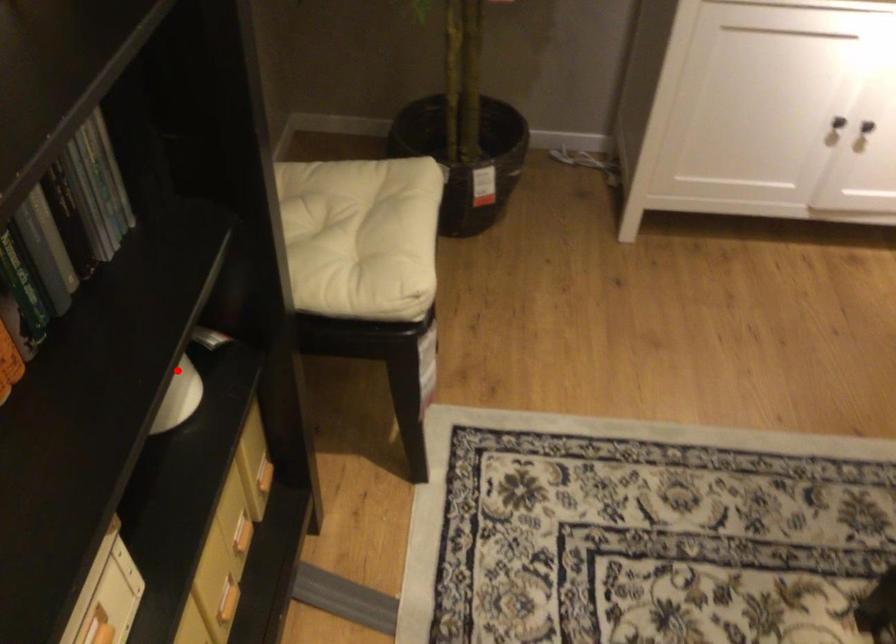
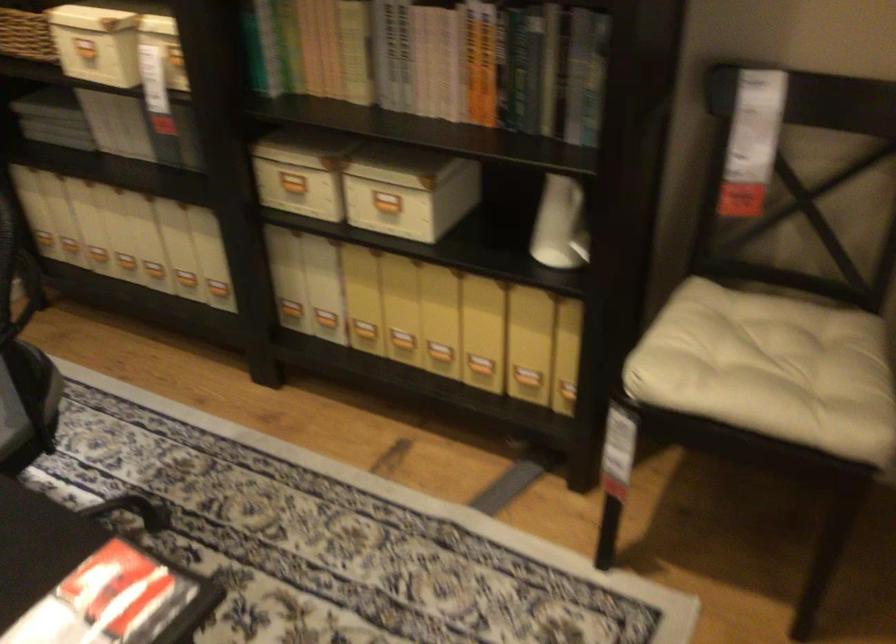
Question: A red point is marked in image1. In image2, is the corresponding 3D point closer to the camera or farther? Reply with the corresponding letter.

Choices:
 (A) The corresponding 3D point is closer.
 (B) The corresponding 3D point is farther.

Answer: (B)